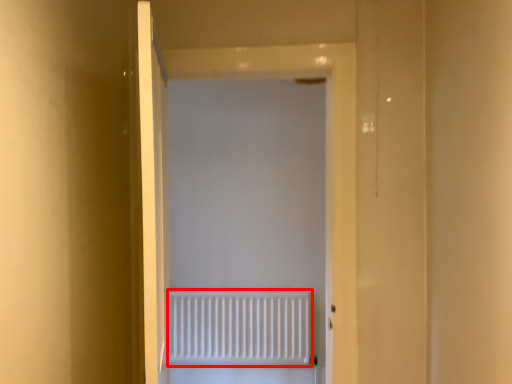
Question: In this image, where is radiator (annotated by the red box) located relative to door?

Choices:
 (A) right
 (B) left

Answer: (B)